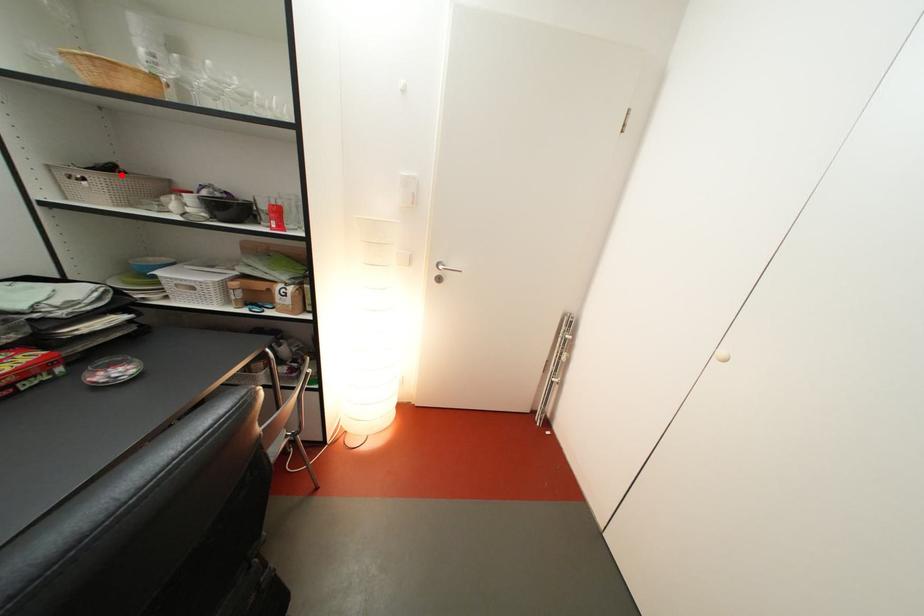
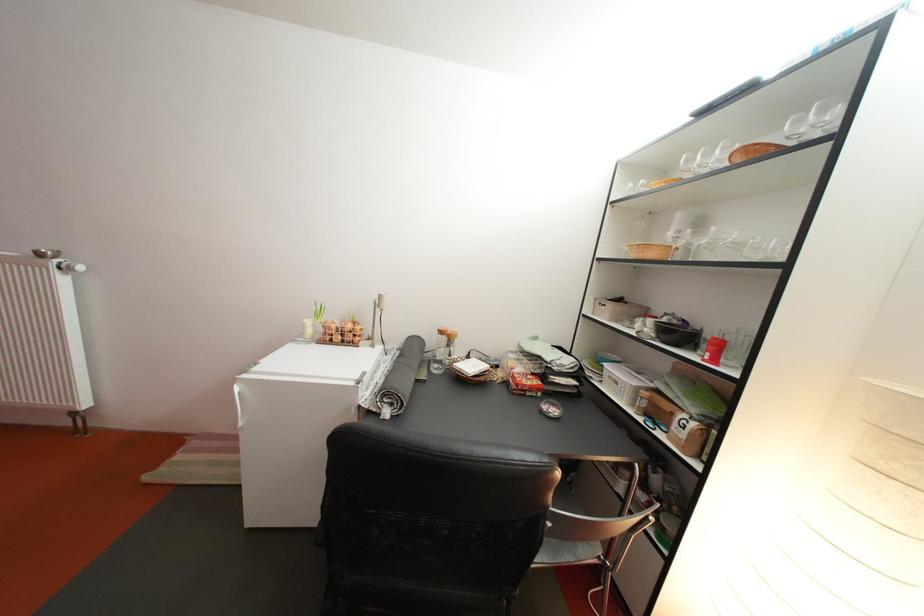
Where in the second image is the point corresponding to the highlighted location from the first image?

(630, 306)